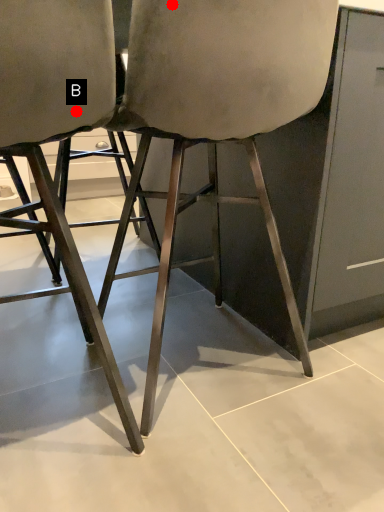
Question: Two points are circled on the image, labeled by A and B beside each circle. Which point is farther to the camera?

Choices:
 (A) A is further
 (B) B is further

Answer: (B)